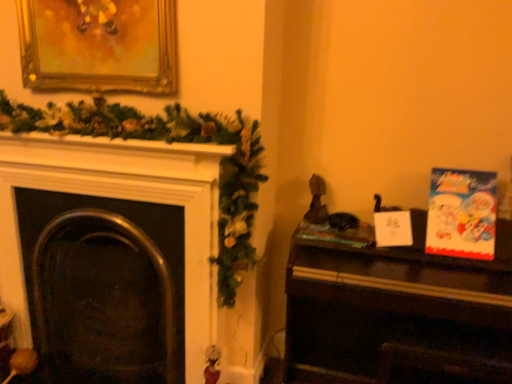
You are a GUI agent. You are given a task and a screenshot of the screen. Output one action in this format:
    pyautogui.click(x=<x>, y=<y>)
    Task: Click on the empty space that is ontop of hardcover book at center-right (from a real-world perspective)
    The width and height of the screenshot is (512, 384).
    Given the screenshot: What is the action you would take?
    pyautogui.click(x=332, y=218)